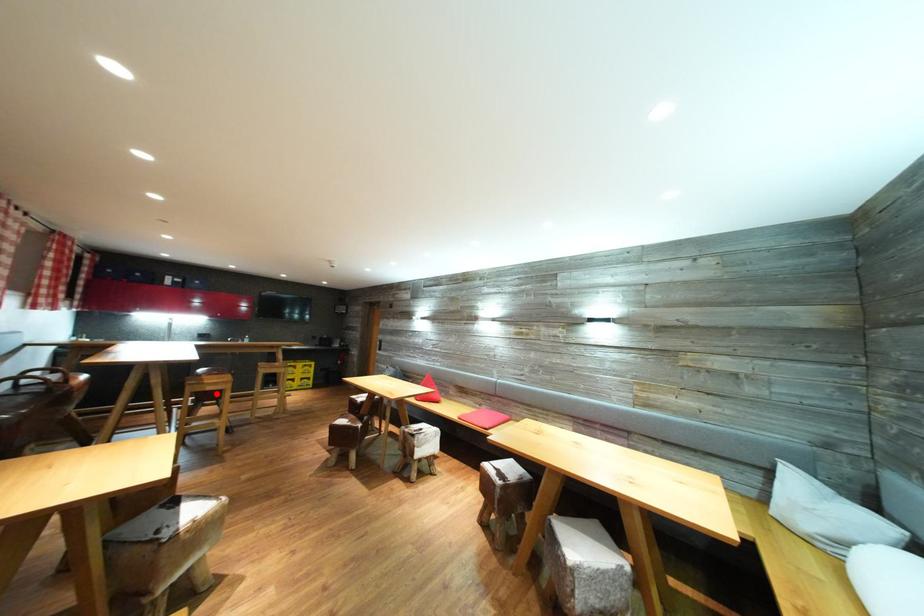
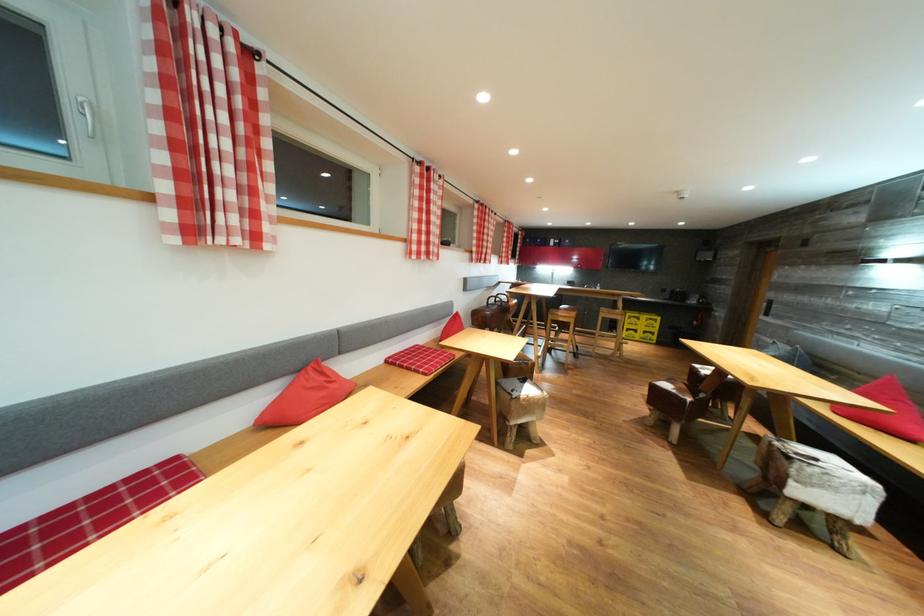
Where in the second image is the point corresponding to the highlighted location from the first image?

(567, 325)